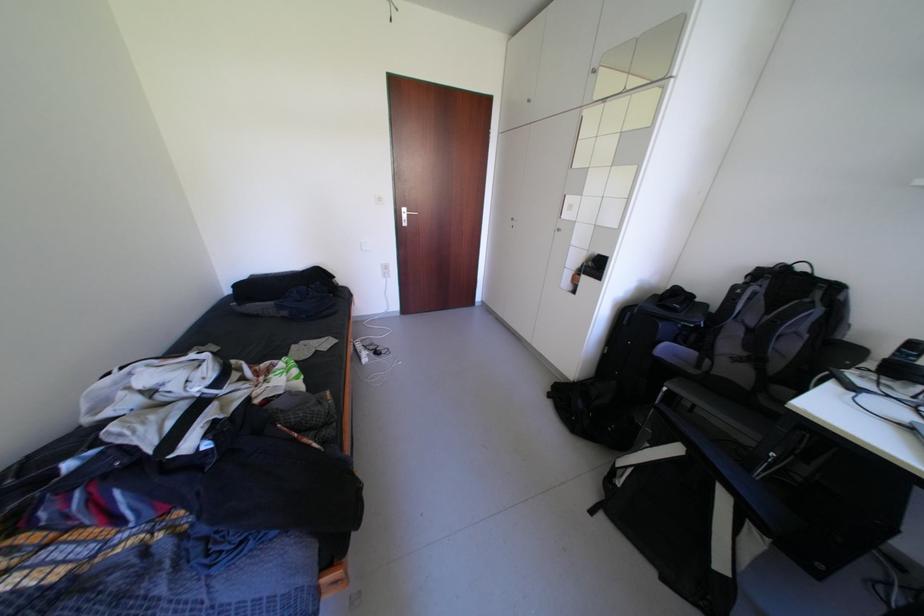
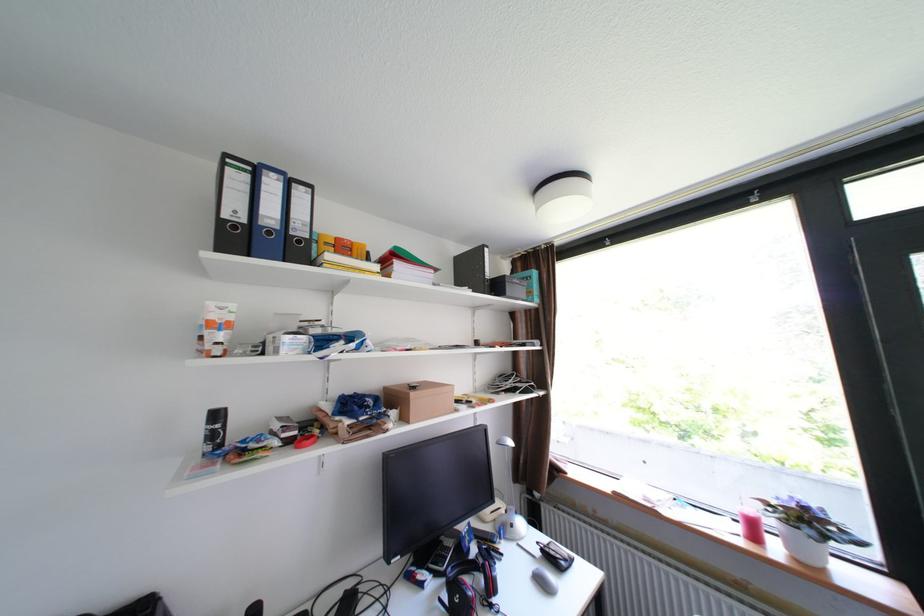
Question: Based on the continuous images, in which direction is the camera rotating? Reply with the corresponding letter.

Choices:
 (A) Left
 (B) Right
 (C) Up
 (D) Down

Answer: (B)